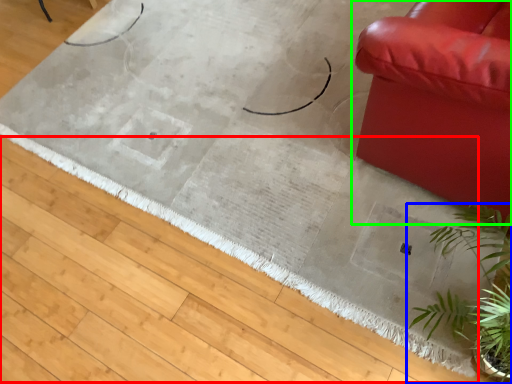
Question: Based on their relative distances, which object is nearer to doormat (highlighted by a red box)? Choose from houseplant (highlighted by a blue box) and studio couch (highlighted by a green box).

Choices:
 (A) houseplant
 (B) studio couch

Answer: (A)